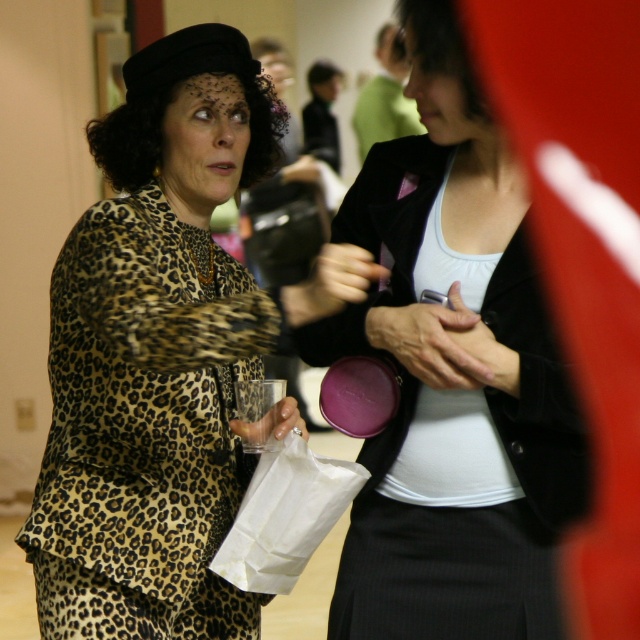
You are at a party and need to grab the white paper bag at lower center without touching the matte black blazer at center. Can you reach it from your current position?

The matte black blazer at center is to the right of the white paper bag at lower center, so you can reach the white paper bag at lower center without touching the matte black blazer at center by moving to the left side of the bag.

You are at a party and need to decide which item is wider between the leopard print dress at center and the white paper bag at lower center. Which one is wider?

The leopard print dress at center is wider than the white paper bag at lower center.